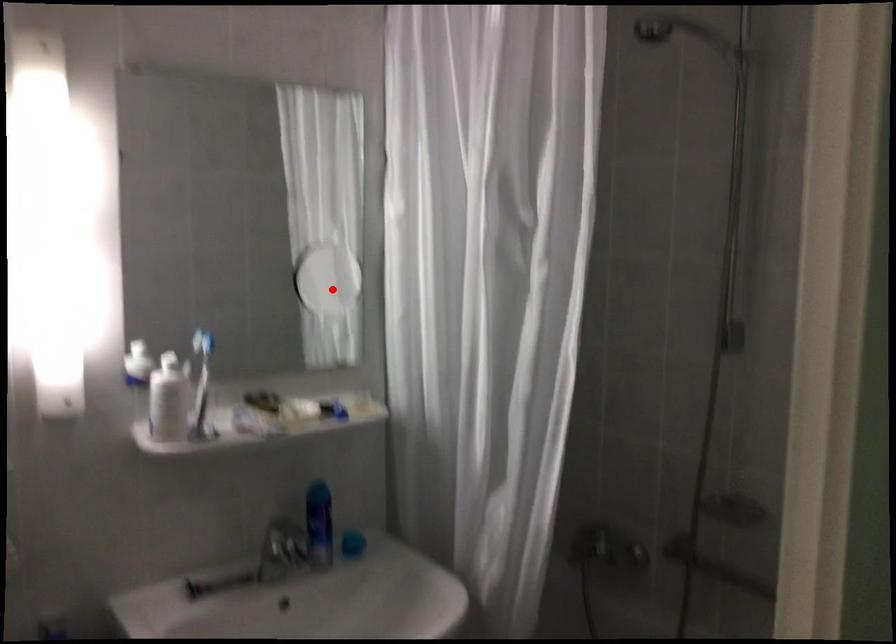
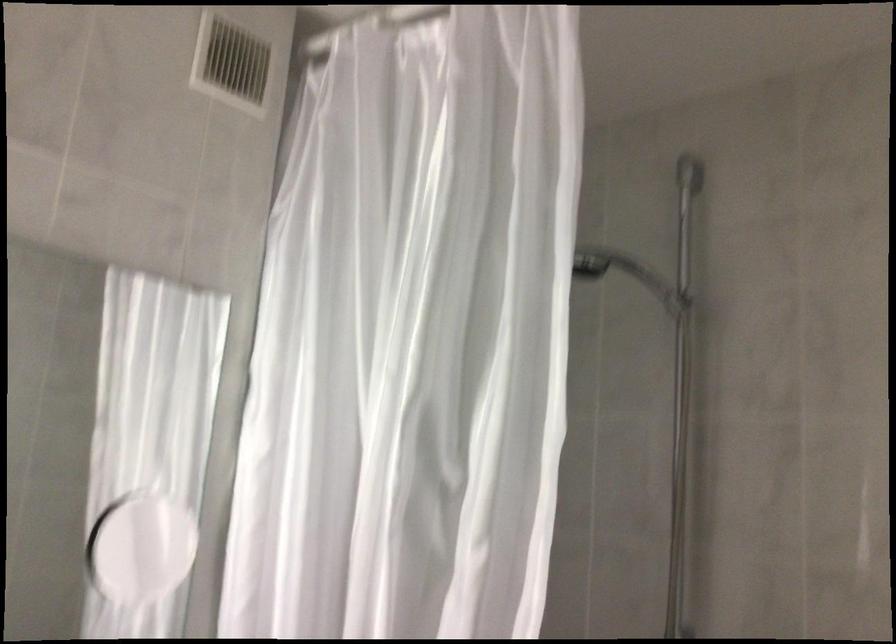
The point at the highlighted location is marked in the first image. Where is the corresponding point in the second image?

(141, 547)